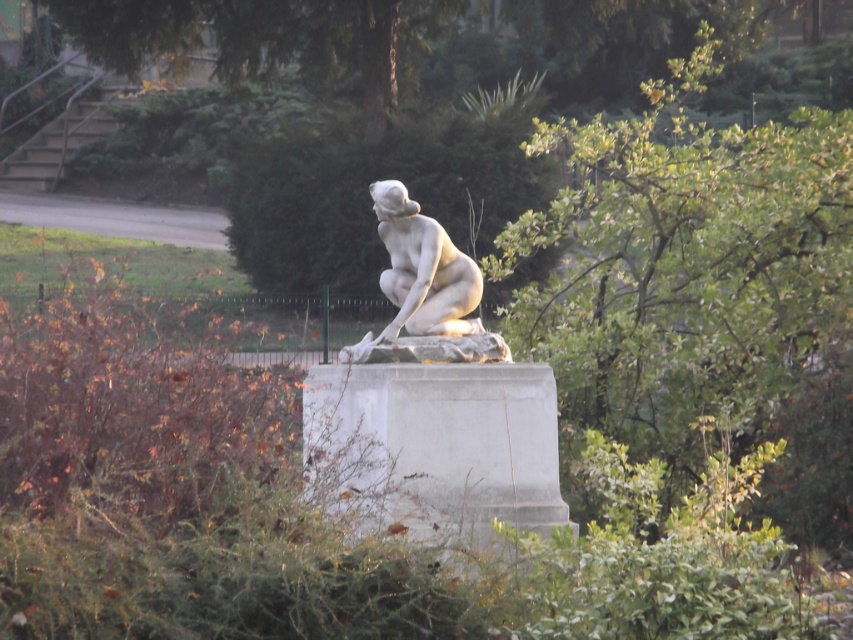
Is point (666, 97) behind point (451, 285)?

Yes, point (666, 97) is behind point (451, 285).

Can you confirm if green leafy tree at upper center is positioned to the left of white marble statue at center?

Incorrect, green leafy tree at upper center is not on the left side of white marble statue at center.

Between point (567, 285) and point (427, 289), which one is positioned in front?

Point (427, 289) is more forward.

What are the coordinates of `green leafy tree at upper center` in the screenshot? It's located at (698, 285).